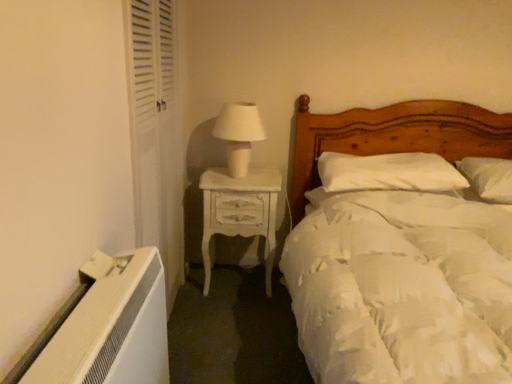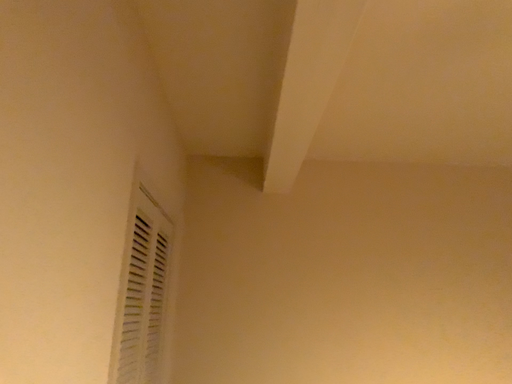
Question: How did the camera likely rotate when shooting the video?

Choices:
 (A) rotated downward
 (B) rotated upward

Answer: (B)